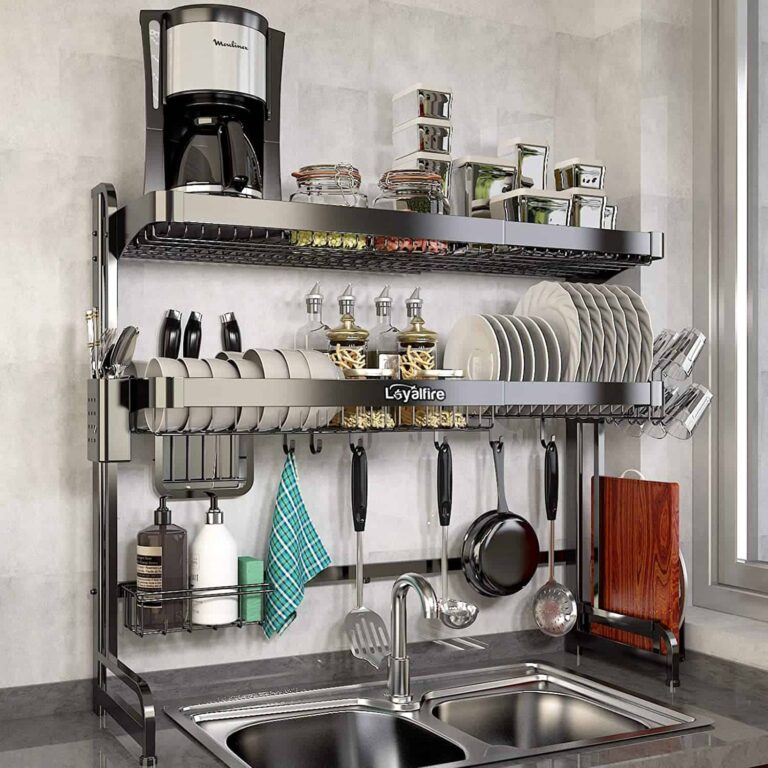
Identify the location of dish cloth. This screenshot has height=768, width=768. (296, 534).